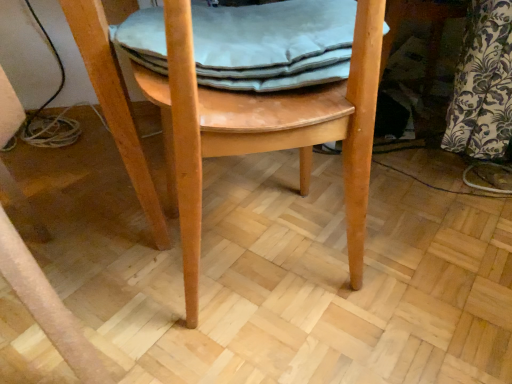
At what (x,y) coordinates should I click in order to perform the action: click on unoccupied area in front of light brown wood chair at center. Please return your answer as a coordinate pair (x, y). The image size is (512, 384). Looking at the image, I should click on (253, 342).